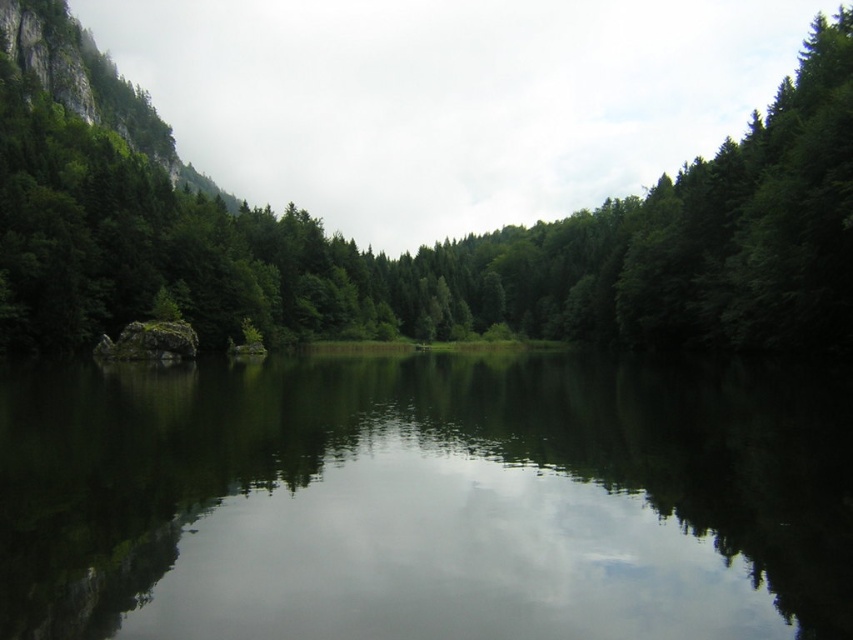
Between point (381, 410) and point (61, 316), which one is positioned behind?

Point (61, 316)

Which of these two, green reflective water at center or green matte tree at center, stands taller?

green matte tree at center

Identify the location of green reflective water at center. The width and height of the screenshot is (853, 640). (424, 499).